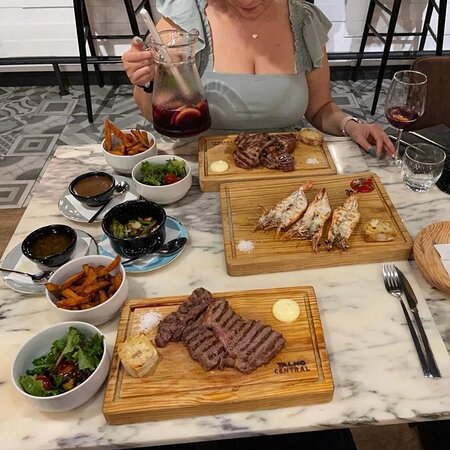
At what (x,y) coordinates should I click in order to perform the action: click on wooden trays. Please return your answer as a coordinate pair (x, y). Looking at the image, I should click on (258, 252), (253, 312), (244, 173), (433, 234).